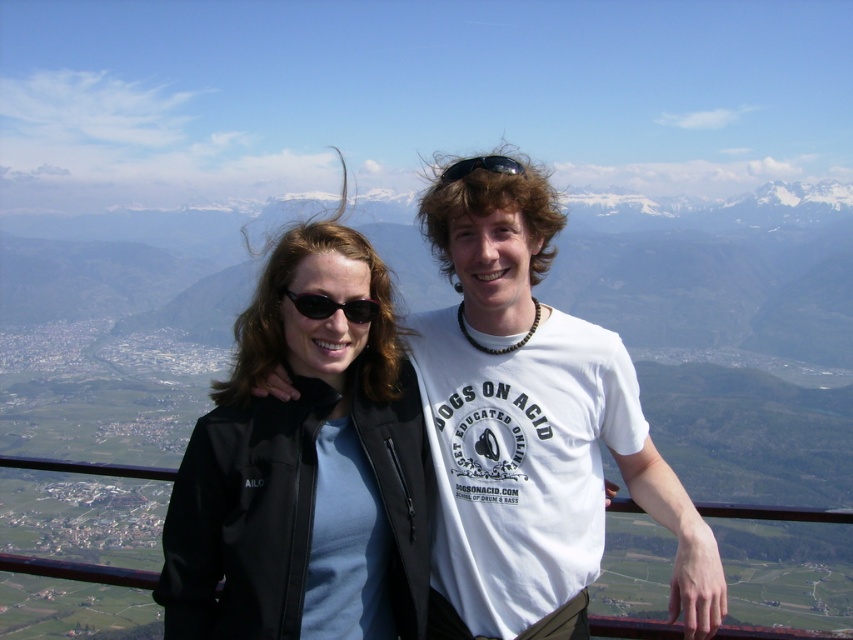
Question: Which object is the closest to the black matte jacket at center?

Choices:
 (A) matte black jacket at center
 (B) black plastic goggles at upper center
 (C) black plastic sunglasses at center

Answer: (A)

Question: Which object is the farthest from the black plastic goggles at upper center?

Choices:
 (A) black matte jacket at center
 (B) matte black jacket at center

Answer: (A)

Question: Among these objects, which one is farthest from the camera?

Choices:
 (A) matte black jacket at center
 (B) black plastic goggles at upper center
 (C) black plastic sunglasses at center
 (D) black matte jacket at center

Answer: (B)

Question: Does black matte jacket at center appear over black plastic sunglasses at center?

Choices:
 (A) yes
 (B) no

Answer: (B)

Question: Does black plastic sunglasses at center have a lesser width compared to black plastic goggles at upper center?

Choices:
 (A) yes
 (B) no

Answer: (A)

Question: Is black matte jacket at center further to camera compared to black plastic sunglasses at center?

Choices:
 (A) yes
 (B) no

Answer: (B)